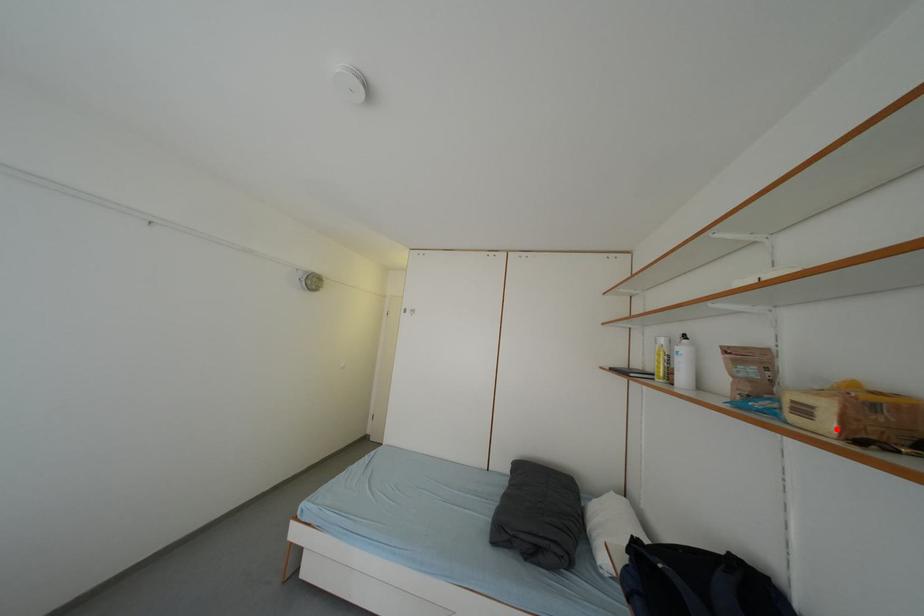
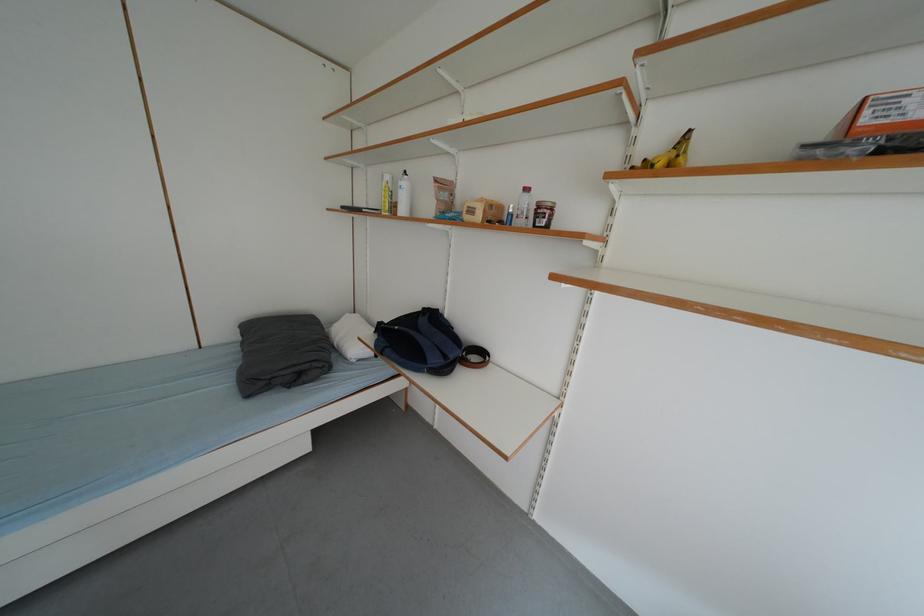
In the second image, find the point that corresponds to the highlighted location in the first image.

(487, 220)